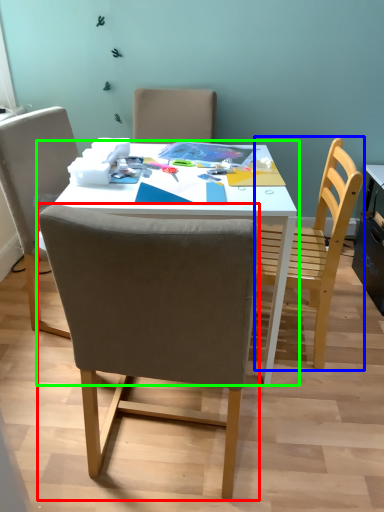
Question: Considering the real-world distances, which object is farthest from chair (highlighted by a red box)? chair (highlighted by a blue box) or table (highlighted by a green box)?

Choices:
 (A) chair
 (B) table

Answer: (A)